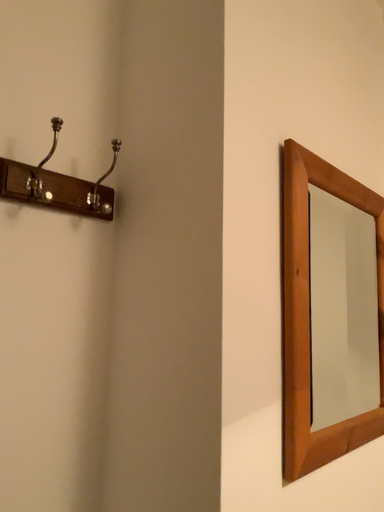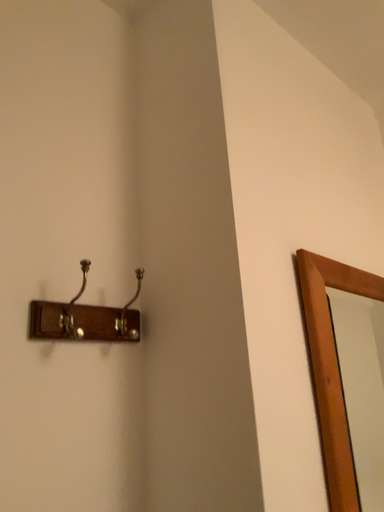
Question: Which way did the camera rotate in the video?

Choices:
 (A) rotated downward
 (B) rotated upward

Answer: (B)